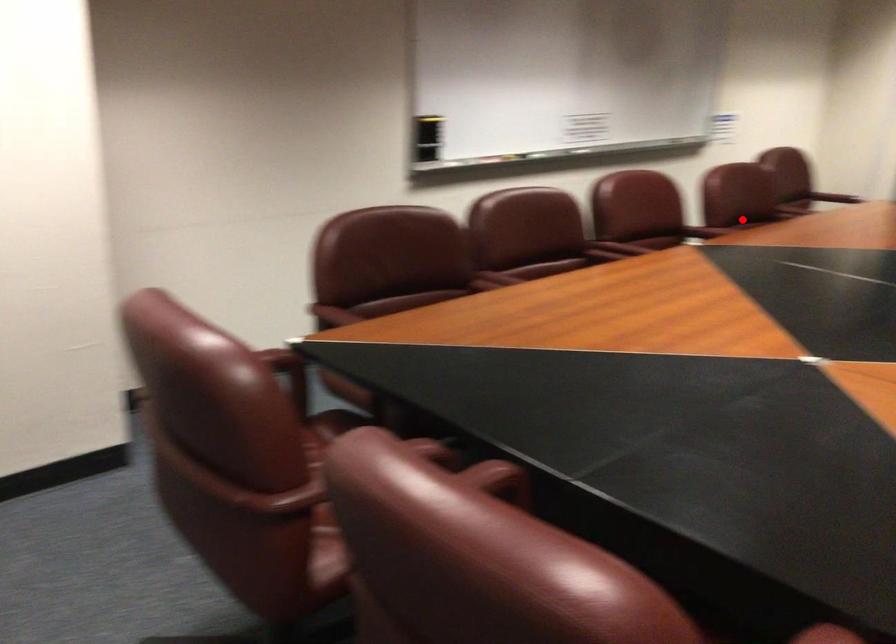
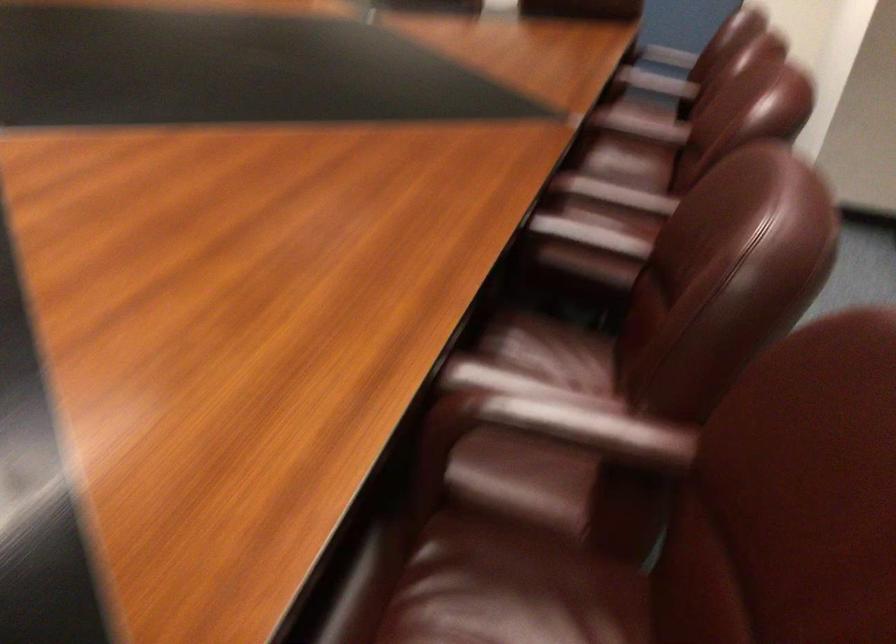
Where in the second image is the point corresponding to the highlighted location from the first image?

(590, 247)